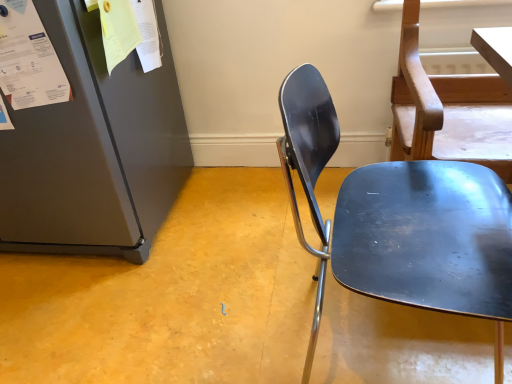
Question: Does white paper at upper left have a larger size compared to metallic blue chair at center?

Choices:
 (A) yes
 (B) no

Answer: (B)

Question: Is white paper at upper left with metallic blue chair at center?

Choices:
 (A) yes
 (B) no

Answer: (B)

Question: Is the position of white paper at upper left less distant than that of metallic blue chair at center?

Choices:
 (A) no
 (B) yes

Answer: (A)

Question: From the image's perspective, is white paper at upper left beneath metallic blue chair at center?

Choices:
 (A) yes
 (B) no

Answer: (B)

Question: Can you confirm if white paper at upper left is wider than metallic blue chair at center?

Choices:
 (A) no
 (B) yes

Answer: (A)

Question: From the image's perspective, is white paper at upper left above metallic blue chair at center?

Choices:
 (A) no
 (B) yes

Answer: (B)

Question: From a real-world perspective, does metallic blue chair at center stand above white paper at upper left?

Choices:
 (A) no
 (B) yes

Answer: (A)

Question: Is metallic blue chair at center placed right next to white paper at upper left?

Choices:
 (A) no
 (B) yes

Answer: (A)

Question: Is metallic blue chair at center thinner than white paper at upper left?

Choices:
 (A) no
 (B) yes

Answer: (A)

Question: Is metallic blue chair at center further to the viewer compared to white paper at upper left?

Choices:
 (A) yes
 (B) no

Answer: (B)

Question: Can you confirm if metallic blue chair at center is shorter than white paper at upper left?

Choices:
 (A) no
 (B) yes

Answer: (A)

Question: Could white paper at upper left be considered to be inside metallic blue chair at center?

Choices:
 (A) no
 (B) yes

Answer: (A)

Question: Is point (8, 64) closer or farther from the camera than point (308, 77)?

Choices:
 (A) farther
 (B) closer

Answer: (A)